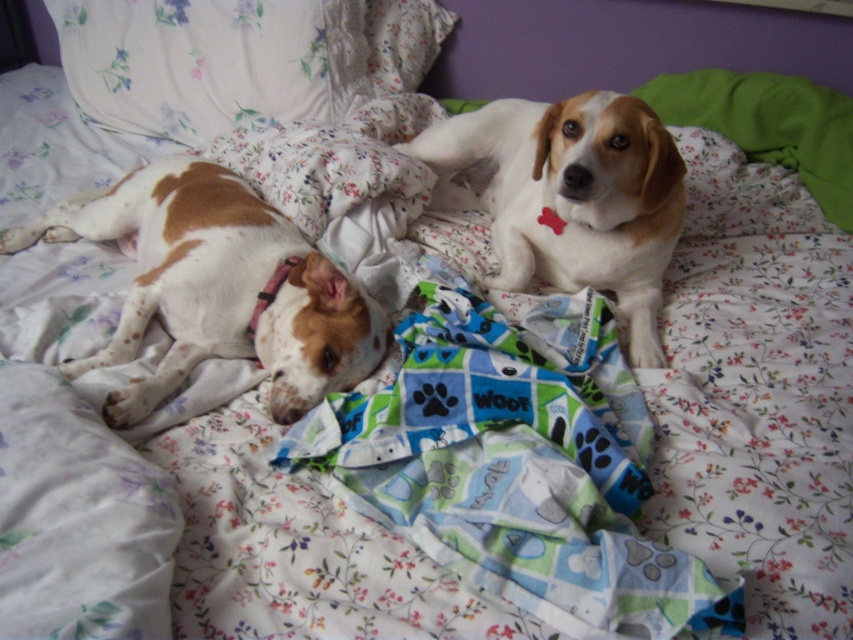
You are trying to determine the spatial relationship between the blue fabric paw print blanket at center and the speckled white fur at left. Which object is wider?

The blue fabric paw print blanket at center is narrower than the speckled white fur at left, so the speckled white fur at left is wider.

You are a photographer aiming to capture a closeup of the speckled white fur at left and the white soft fur dog at upper right. Which dog should you focus on first to ensure both are in focus?

You should focus on the speckled white fur at left first since it is closer to the viewer than the white soft fur dog at upper right, allowing the camera to adjust focus starting from the nearest subject.